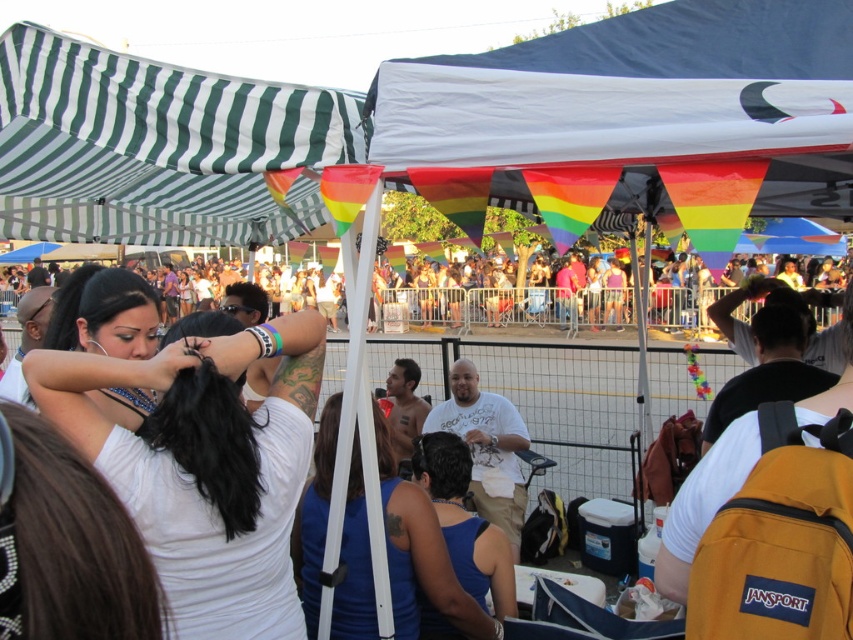
Between smooth black hair at center and blue matte tank top at center, which one has more height?

Standing taller between the two is smooth black hair at center.

Does smooth black hair at center have a greater height compared to blue matte tank top at center?

Yes, smooth black hair at center is taller than blue matte tank top at center.

You are a GUI agent. You are given a task and a screenshot of the screen. Output one action in this format:
    pyautogui.click(x=<x>, y=<y>)
    Task: Click on the smooth black hair at center
    Image resolution: width=853 pixels, height=640 pixels.
    Given the screenshot: What is the action you would take?
    pyautogui.click(x=202, y=461)

Identify the location of smooth black hair at center. The height and width of the screenshot is (640, 853). (202, 461).

Which is behind, point (248, 470) or point (509, 304)?

The point (509, 304) is more distant.

Who is taller, smooth black hair at center or multicolored fabric crowd at center?

Standing taller between the two is multicolored fabric crowd at center.

Between point (318, 372) and point (389, 308), which one is positioned behind?

The point (389, 308) is more distant.

The width and height of the screenshot is (853, 640). I want to click on smooth black hair at center, so click(x=202, y=461).

Is blue matte tank top at center above multicolored fabric crowd at center?

Incorrect, blue matte tank top at center is not positioned above multicolored fabric crowd at center.

Is point (407, 550) farther from viewer compared to point (383, 289)?

No, (407, 550) is in front of (383, 289).

Does point (471, 624) come closer to viewer compared to point (456, 291)?

Yes, it is.

This screenshot has height=640, width=853. I want to click on blue matte tank top at center, so click(419, 552).